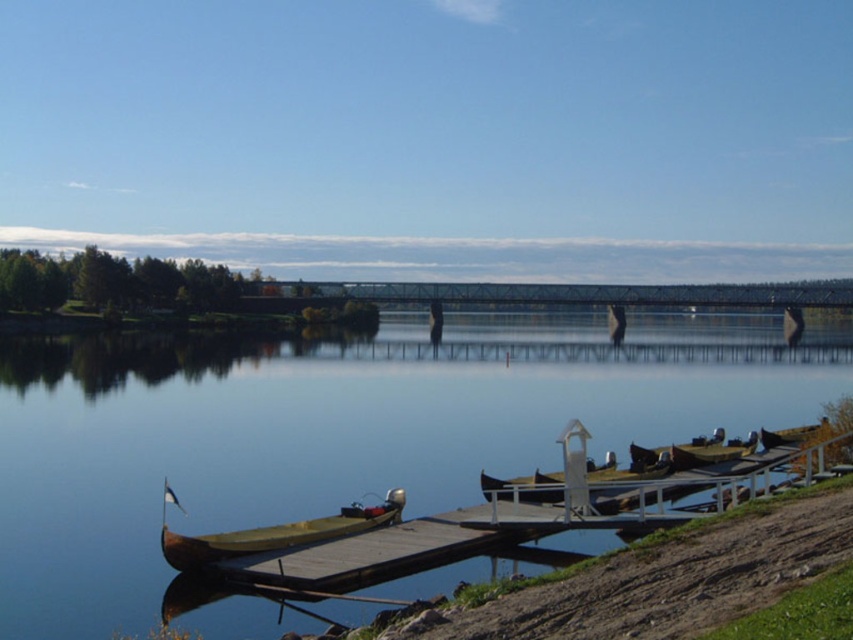
I want to click on smooth blue water at center, so click(305, 442).

Between smooth blue water at center and brown dirt at lower right, which one has less height?

brown dirt at lower right

What do you see at coordinates (305, 442) in the screenshot?
I see `smooth blue water at center` at bounding box center [305, 442].

At what (x,y) coordinates should I click in order to perform the action: click on smooth blue water at center. Please return your answer as a coordinate pair (x, y). Image resolution: width=853 pixels, height=640 pixels. Looking at the image, I should click on (305, 442).

Is point (766, 534) farther from viewer compared to point (254, 547)?

No, (766, 534) is closer to viewer.

Is brown dirt at lower right thinner than yellow wood canoe at lower left?

Correct, brown dirt at lower right's width is less than yellow wood canoe at lower left's.

Describe the element at coordinates (663, 577) in the screenshot. Image resolution: width=853 pixels, height=640 pixels. I see `brown dirt at lower right` at that location.

Locate an element on the screen. This screenshot has height=640, width=853. brown dirt at lower right is located at coordinates click(663, 577).

Between smooth blue water at center and yellow wood canoe at lower left, which one appears on the left side from the viewer's perspective?

yellow wood canoe at lower left is more to the left.

Looking at this image, can you confirm if smooth blue water at center is shorter than yellow wood canoe at lower left?

No, smooth blue water at center is not shorter than yellow wood canoe at lower left.

Who is more forward, [726,376] or [376,518]?

Positioned in front is point [376,518].

Where is `smooth blue water at center`? Image resolution: width=853 pixels, height=640 pixels. smooth blue water at center is located at coordinates (305, 442).